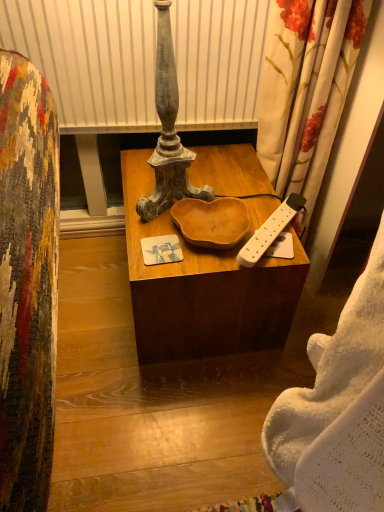
Question: From the image's perspective, is wooden bowl at center above white knitted blanket at right?

Choices:
 (A) no
 (B) yes

Answer: (B)

Question: Does wooden bowl at center have a greater width compared to white knitted blanket at right?

Choices:
 (A) yes
 (B) no

Answer: (A)

Question: Is wooden bowl at center looking in the opposite direction of white knitted blanket at right?

Choices:
 (A) no
 (B) yes

Answer: (A)

Question: Considering the relative sizes of wooden bowl at center and white knitted blanket at right in the image provided, is wooden bowl at center bigger than white knitted blanket at right?

Choices:
 (A) yes
 (B) no

Answer: (A)

Question: Does wooden bowl at center have a smaller size compared to white knitted blanket at right?

Choices:
 (A) yes
 (B) no

Answer: (B)

Question: Considering the positions of point (304, 202) and point (233, 253), is point (304, 202) closer or farther from the camera than point (233, 253)?

Choices:
 (A) closer
 (B) farther

Answer: (B)

Question: Based on their sizes in the image, would you say white plastic remote control at right is bigger or smaller than wooden bowl at center?

Choices:
 (A) small
 (B) big

Answer: (A)

Question: From a real-world perspective, is white plastic remote control at right above or below wooden bowl at center?

Choices:
 (A) above
 (B) below

Answer: (A)

Question: Is white plastic remote control at right wider or thinner than wooden bowl at center?

Choices:
 (A) thin
 (B) wide

Answer: (A)

Question: Based on their positions, is wooden bowl at center located to the left or right of white knitted blanket at right?

Choices:
 (A) right
 (B) left

Answer: (B)

Question: From the image's perspective, is wooden bowl at center located above or below white knitted blanket at right?

Choices:
 (A) above
 (B) below

Answer: (A)

Question: Is wooden bowl at center bigger or smaller than white knitted blanket at right?

Choices:
 (A) big
 (B) small

Answer: (A)

Question: In the image, is wooden bowl at center positioned in front of or behind white knitted blanket at right?

Choices:
 (A) front
 (B) behind

Answer: (B)

Question: Based on their sizes in the image, would you say white plastic remote control at right is bigger or smaller than white knitted blanket at right?

Choices:
 (A) big
 (B) small

Answer: (B)

Question: Is white plastic remote control at right situated inside white knitted blanket at right or outside?

Choices:
 (A) inside
 (B) outside

Answer: (B)